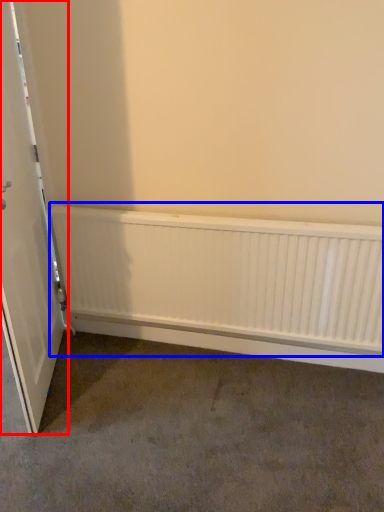
Question: Which object appears farthest to the camera in this image, door (highlighted by a red box) or radiator (highlighted by a blue box)?

Choices:
 (A) door
 (B) radiator

Answer: (B)